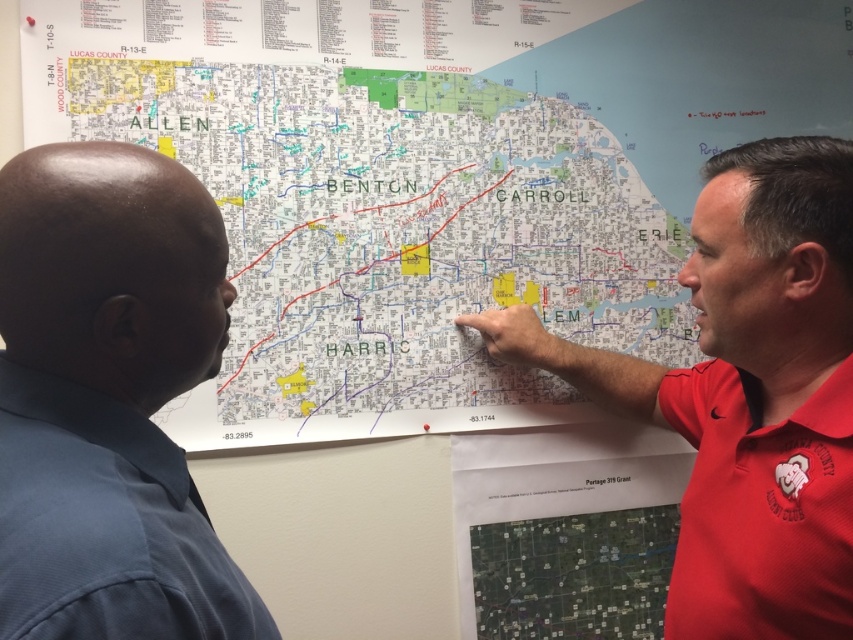
Question: Estimate the real-world distances between objects in this image. Which object is closer to the blue shirt at left?

Choices:
 (A) red cotton polo shirt at right
 (B) red shirt at upper right

Answer: (B)

Question: Is white paper map at upper center wider than red shirt at upper right?

Choices:
 (A) yes
 (B) no

Answer: (A)

Question: Which point is closer to the camera?

Choices:
 (A) red shirt at upper right
 (B) blue shirt at left
 (C) red cotton polo shirt at right

Answer: (B)

Question: Is white paper map at upper center to the left of blue shirt at left from the viewer's perspective?

Choices:
 (A) yes
 (B) no

Answer: (B)

Question: Which object is positioned closest to the blue shirt at left?

Choices:
 (A) white paper map at upper center
 (B) red cotton polo shirt at right

Answer: (B)

Question: Is white paper map at upper center in front of blue shirt at left?

Choices:
 (A) no
 (B) yes

Answer: (A)